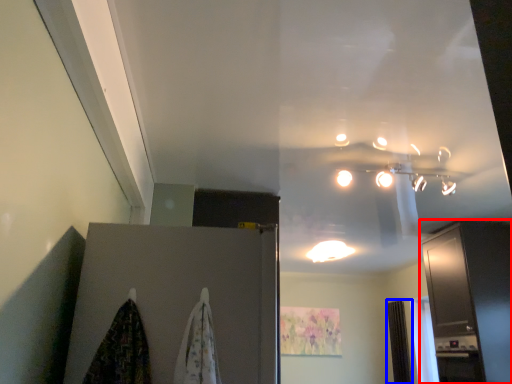
Question: Which object appears farthest to the camera in this image, cabinetry (highlighted by a red box) or curtain (highlighted by a blue box)?

Choices:
 (A) cabinetry
 (B) curtain

Answer: (B)